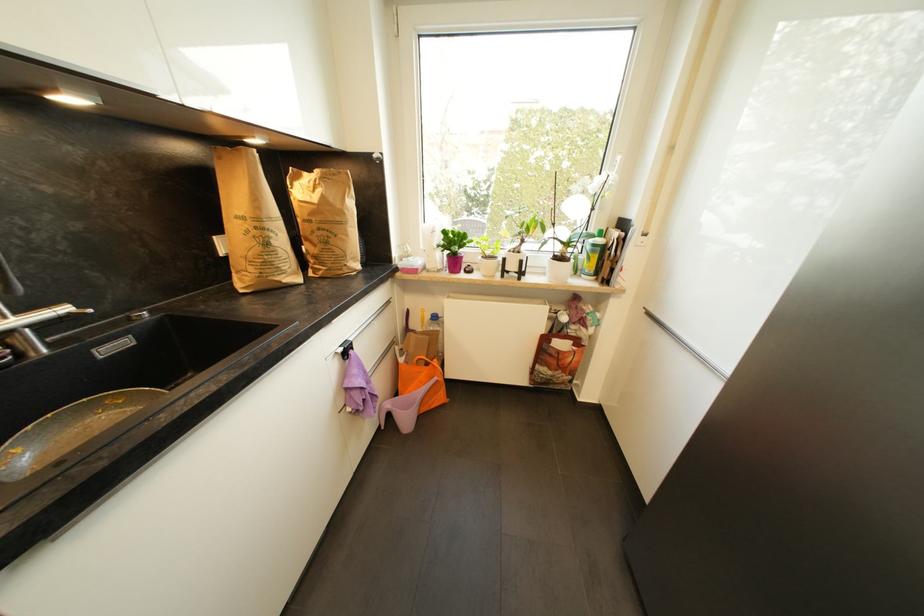
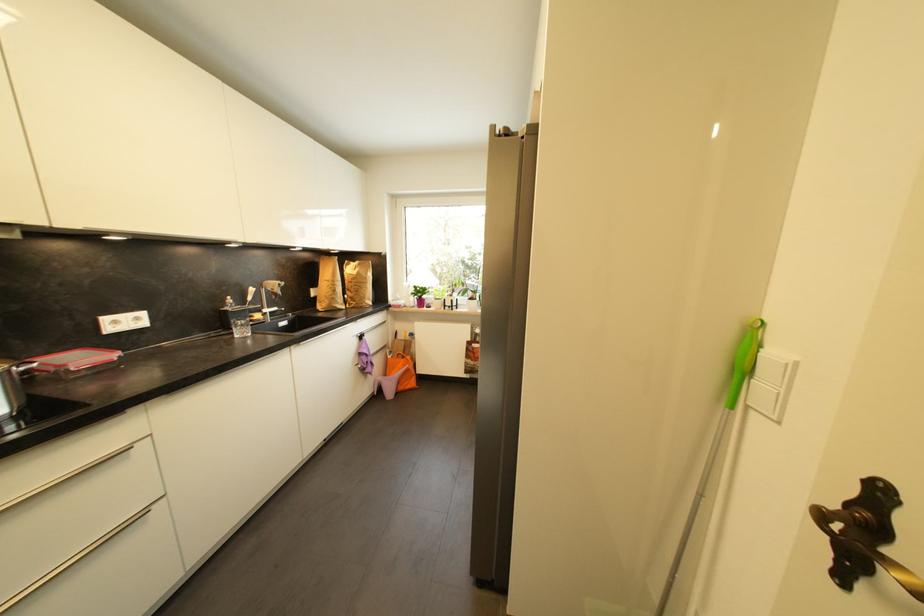
In the second image, find the point that corresponds to the point at 272,246 in the first image.

(339, 293)